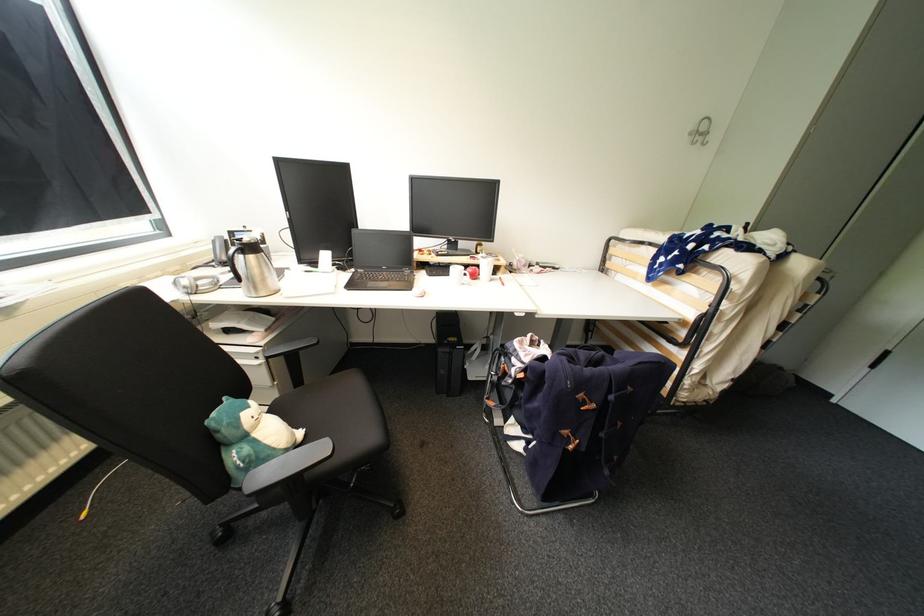
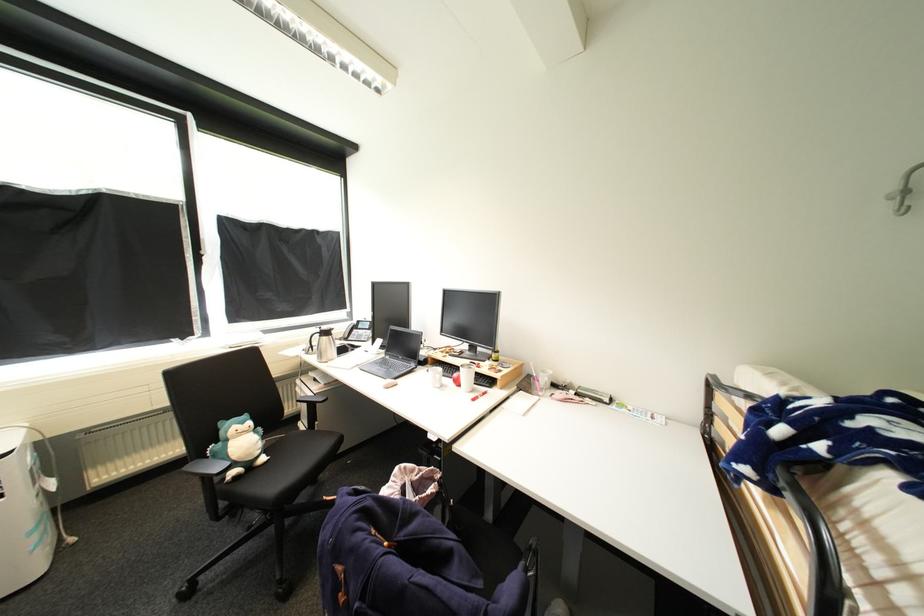
In the second image, find the point that corresponds to point 307,435 in the first image.

(270, 460)